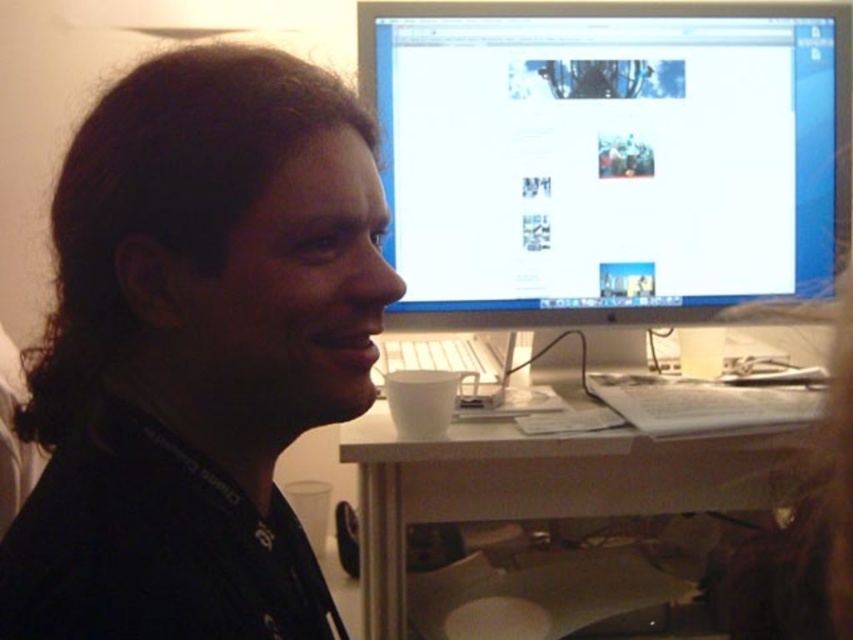
You are organizing a photoshoot and need to ensure that the black matte shirt at center and the white plastic desk at lower center are both visible in the frame. Based on their sizes, which object might require more careful framing to ensure it doesn not get lost in the background?

The black matte shirt at center might require more careful framing since it occupies less space than the white plastic desk at lower center, making it potentially smaller and easier to overlook in the composition.

You are standing at the desk in the image. There are two points marked on the desk surface. One is at point (759, 148) and the other at point (770, 483). Which point is closer to you?

Point (770, 483) is closer to you because it is in front of point (759, 148).

From the picture: Based on the coordinates provided, where is the black matte shirt at center located in the image?

The black matte shirt at center is located at point coordinates of 0.550 in the x direction and 0.231 in the y direction.